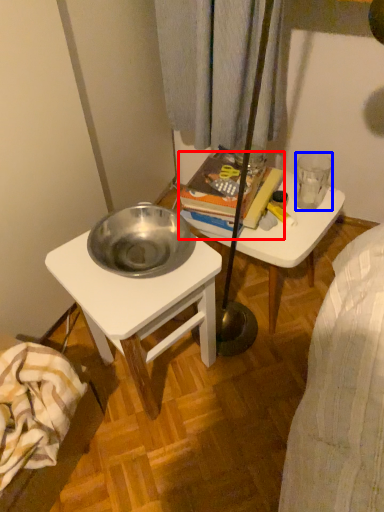
Question: Which object is further to the camera taking this photo, book (highlighted by a red box) or coffee cup (highlighted by a blue box)?

Choices:
 (A) book
 (B) coffee cup

Answer: (B)